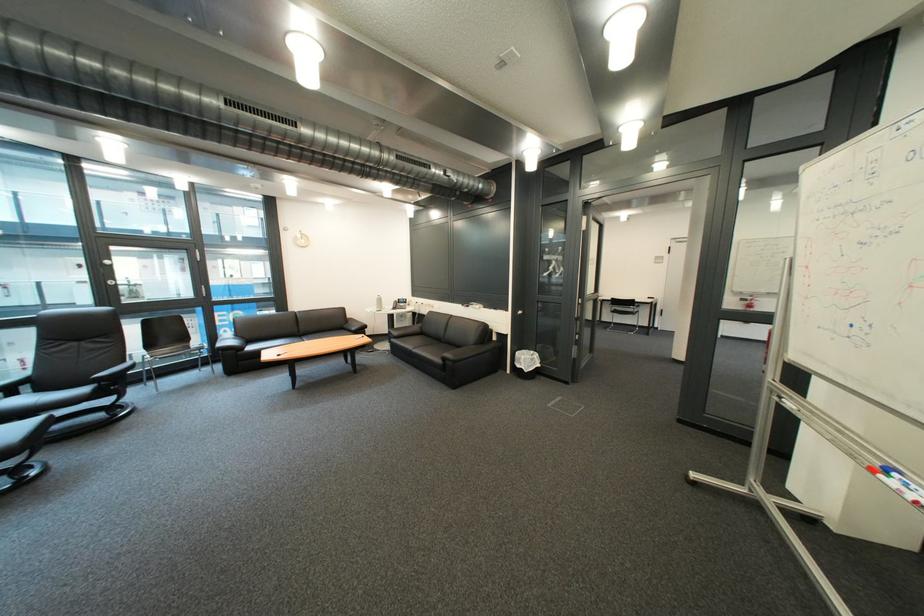
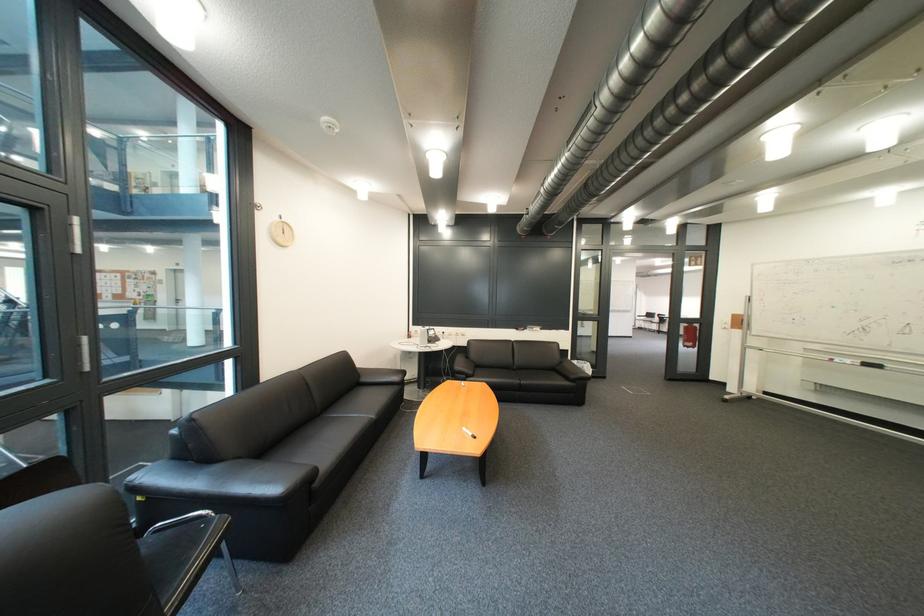
Find the pixel in the second image that matches the point at 426,297 in the first image.

(428, 326)